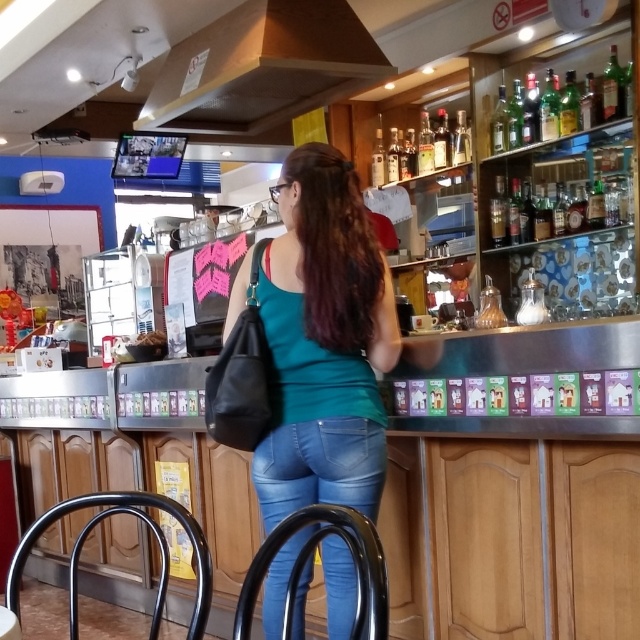
You are a customer at the cafe and want to point out the jeans at center and the translucent glass bottles at upper right in the scene. From your perspective, which item is positioned more to the left?

The jeans at center are positioned to the left of the translucent glass bottles at upper right, so the jeans at center are more to the left.

You are a customer in the cafe and want to grab a bottle from the translucent glass bottles at upper right. However, you are standing at the teal matte tank top at center. Can you reach the bottles without moving your position?

The teal matte tank top at center is 2.49 meters away from the translucent glass bottles at upper right. Since the distance is too far, you cannot reach the bottles without moving closer.

You are a customer at the cafe and want to see the menu options on the counter. However, the woman in jeans at center is blocking your view. Can you see the translucent glass bottles at upper right behind her?

The jeans at center is in front of the translucent glass bottles at upper right, so the woman in jeans at center is blocking your view of the translucent glass bottles at upper right.